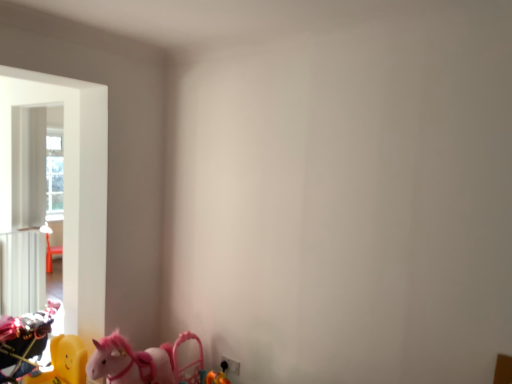
Question: From the image's perspective, relative to yellow plastic toy horse at lower left, positioned as the 1th toy in right-to-left order, is shiny metallic motorcycle at left, which is counted as the 1th toy, starting from the left, above or below?

Choices:
 (A) below
 (B) above

Answer: (B)

Question: Considering the positions of shiny metallic motorcycle at left, which is counted as the 2th toy, starting from the right, and yellow plastic toy horse at lower left, positioned as the 1th toy in right-to-left order, in the image, is shiny metallic motorcycle at left, which is counted as the 2th toy, starting from the right, bigger or smaller than yellow plastic toy horse at lower left, positioned as the 1th toy in right-to-left order,?

Choices:
 (A) big
 (B) small

Answer: (A)

Question: From a real-world perspective, relative to yellow plastic toy horse at lower left, the 2th toy when ordered from left to right, is shiny metallic motorcycle at left, which is counted as the 1th toy, starting from the left, vertically above or below?

Choices:
 (A) below
 (B) above

Answer: (B)

Question: From the image's perspective, relative to shiny metallic motorcycle at left, which is counted as the 2th toy, starting from the right, is yellow plastic toy horse at lower left, the 2th toy when ordered from left to right, above or below?

Choices:
 (A) below
 (B) above

Answer: (A)

Question: Choose the correct answer: Is yellow plastic toy horse at lower left, the 2th toy when ordered from left to right, inside shiny metallic motorcycle at left, which is counted as the 1th toy, starting from the left, or outside it?

Choices:
 (A) outside
 (B) inside

Answer: (A)

Question: In terms of height, does yellow plastic toy horse at lower left, positioned as the 1th toy in right-to-left order, look taller or shorter compared to shiny metallic motorcycle at left, which is counted as the 1th toy, starting from the left?

Choices:
 (A) tall
 (B) short

Answer: (B)

Question: Relative to shiny metallic motorcycle at left, which is counted as the 1th toy, starting from the left, is yellow plastic toy horse at lower left, the 2th toy when ordered from left to right, in front or behind?

Choices:
 (A) behind
 (B) front

Answer: (B)